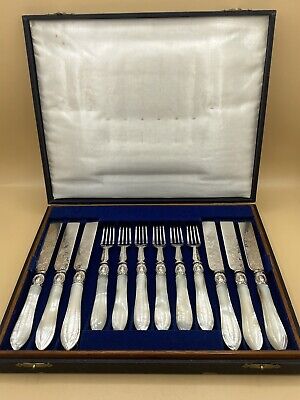
Locate an element on the screen. The image size is (300, 400). silver forks is located at coordinates (203, 278), (180, 295), (162, 304), (139, 314), (116, 311), (102, 311).